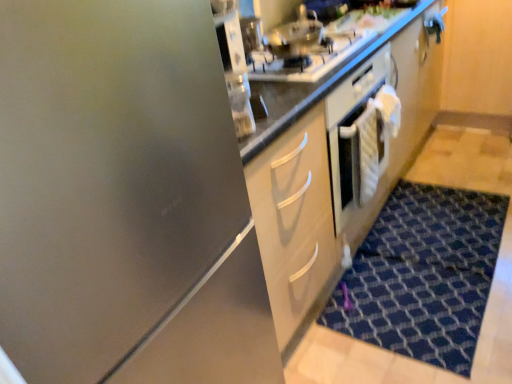
Question: Should I look upward or downward to see stainless steel at upper center?

Choices:
 (A) up
 (B) down

Answer: (A)

Question: Would you say blue textured rug at lower right is a long distance from stainless steel gas stove at upper center?

Choices:
 (A) yes
 (B) no

Answer: (B)

Question: Is blue textured rug at lower right smaller than stainless steel gas stove at upper center?

Choices:
 (A) no
 (B) yes

Answer: (A)

Question: Is blue textured rug at lower right turned away from stainless steel gas stove at upper center?

Choices:
 (A) yes
 (B) no

Answer: (B)

Question: Can you confirm if blue textured rug at lower right is shorter than stainless steel gas stove at upper center?

Choices:
 (A) yes
 (B) no

Answer: (A)

Question: Is blue textured rug at lower right not inside stainless steel gas stove at upper center?

Choices:
 (A) no
 (B) yes

Answer: (B)

Question: Is blue textured rug at lower right in front of stainless steel gas stove at upper center?

Choices:
 (A) no
 (B) yes

Answer: (A)

Question: Considering the relative sizes of stainless steel at upper center and stainless steel gas stove at upper center in the image provided, is stainless steel at upper center shorter than stainless steel gas stove at upper center?

Choices:
 (A) no
 (B) yes

Answer: (A)

Question: Is stainless steel at upper center bigger than stainless steel gas stove at upper center?

Choices:
 (A) no
 (B) yes

Answer: (A)

Question: From the image's perspective, is stainless steel at upper center below stainless steel gas stove at upper center?

Choices:
 (A) yes
 (B) no

Answer: (B)

Question: Is stainless steel at upper center wider than stainless steel gas stove at upper center?

Choices:
 (A) yes
 (B) no

Answer: (B)

Question: Is stainless steel at upper center outside stainless steel gas stove at upper center?

Choices:
 (A) yes
 (B) no

Answer: (A)

Question: Is stainless steel at upper center with stainless steel gas stove at upper center?

Choices:
 (A) no
 (B) yes

Answer: (B)

Question: Is stainless steel at upper center at the back of stainless steel gas stove at upper center?

Choices:
 (A) no
 (B) yes

Answer: (A)